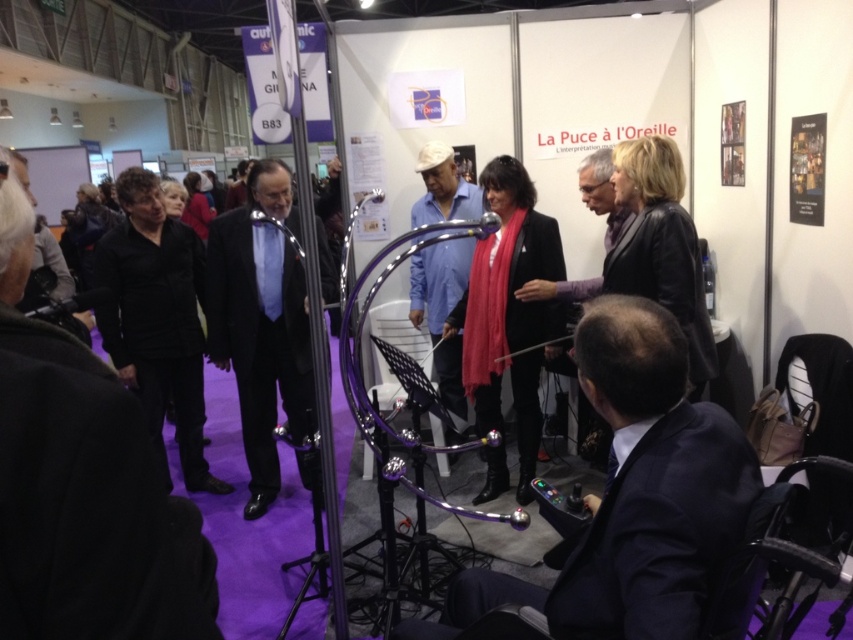
Is black satin suit at center thinner than blue matte shirt at center?

In fact, black satin suit at center might be wider than blue matte shirt at center.

I want to click on black satin suit at center, so coord(260,323).

You are a GUI agent. You are given a task and a screenshot of the screen. Output one action in this format:
    pyautogui.click(x=<x>, y=<y>)
    Task: Click on the black satin suit at center
    
    Given the screenshot: What is the action you would take?
    pyautogui.click(x=260, y=323)

Between black leather jacket at upper left and blue matte shirt at center, which one appears on the left side from the viewer's perspective?

From the viewer's perspective, black leather jacket at upper left appears more on the left side.

Can you confirm if black leather jacket at upper left is taller than blue matte shirt at center?

In fact, black leather jacket at upper left may be shorter than blue matte shirt at center.

Does point (30, 403) lie in front of point (463, 211)?

Yes.

Where is `black leather jacket at upper left`? black leather jacket at upper left is located at coordinates (80, 484).

Describe the element at coordinates (80, 484) in the screenshot. I see `black leather jacket at upper left` at that location.

Which is below, black leather jacket at upper left or dark blue suit at lower right?

dark blue suit at lower right

The image size is (853, 640). In order to click on black leather jacket at upper left in this screenshot , I will do `click(80, 484)`.